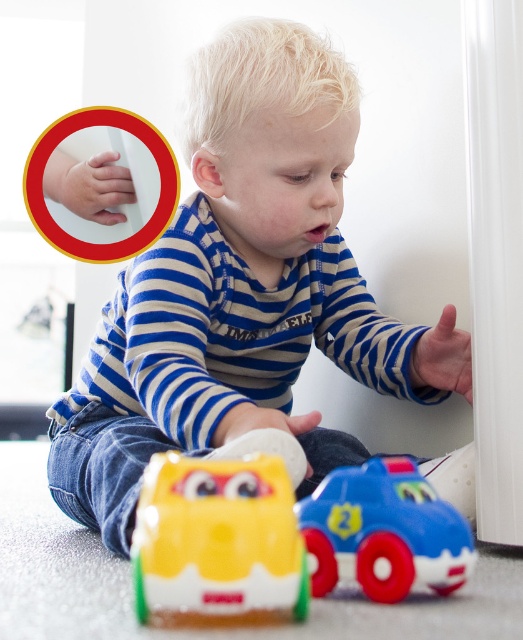
Which of these two, matte plastic hand at upper left or rubberized yellow car at lower center, stands taller?

With more height is matte plastic hand at upper left.

This screenshot has height=640, width=523. Find the location of `matte plastic hand at upper left`. matte plastic hand at upper left is located at coordinates tap(243, 289).

Identify the location of matte plastic hand at upper left. (243, 289).

Which of these two, matte plastic hand at upper left or blue plastic toy car at lower center, stands taller?

With more height is matte plastic hand at upper left.

Which is more to the right, matte plastic hand at upper left or blue plastic toy car at lower center?

From the viewer's perspective, blue plastic toy car at lower center appears more on the right side.

Which is behind, point (454, 356) or point (327, 540)?

Point (454, 356)

Where is `matte plastic hand at upper left`? matte plastic hand at upper left is located at coordinates (243, 289).

Does rubberized yellow car at lower center have a greater height compared to blue plastic toy car at lower center?

Yes.

The image size is (523, 640). What are the coordinates of `rubberized yellow car at lower center` in the screenshot? It's located at [x=218, y=544].